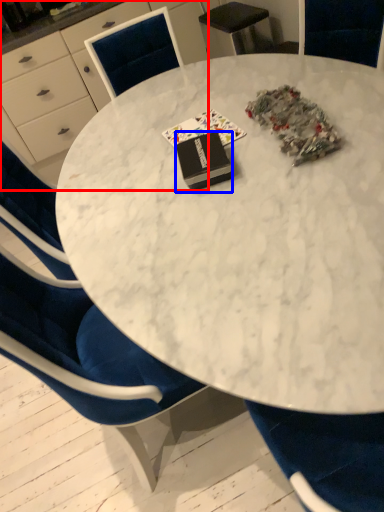
Question: Among these objects, which one is farthest to the camera, desk (highlighted by a red box) or book (highlighted by a blue box)?

Choices:
 (A) desk
 (B) book

Answer: (A)